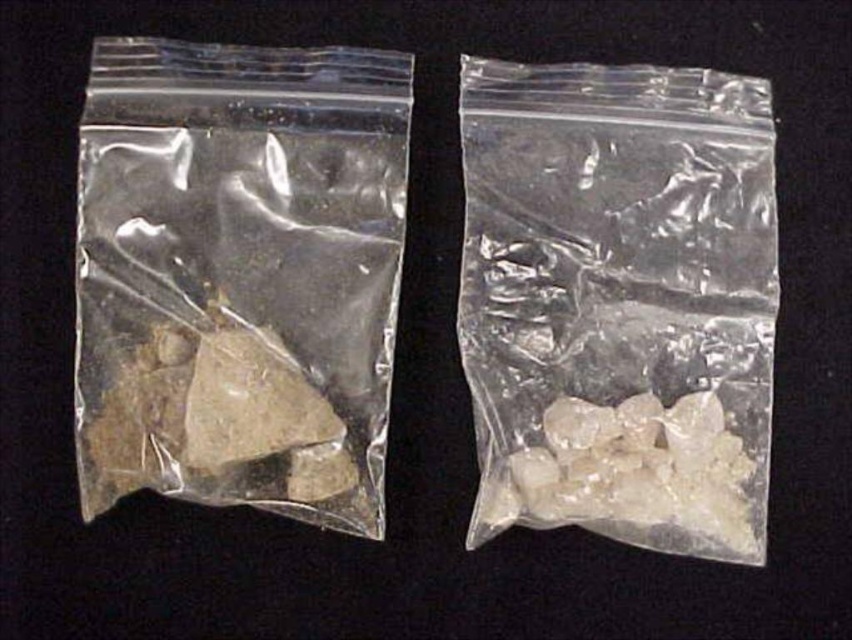
Who is more distant from viewer, [735,403] or [599,518]?

Point [599,518]

Identify the location of transparent plastic bag at center. This screenshot has width=852, height=640. (619, 301).

At what (x,y) coordinates should I click in order to perform the action: click on transparent plastic bag at center. Please return your answer as a coordinate pair (x, y). This screenshot has width=852, height=640. Looking at the image, I should click on (619, 301).

You are a GUI agent. You are given a task and a screenshot of the screen. Output one action in this format:
    pyautogui.click(x=<x>, y=<y>)
    Task: Click on the translucent plastic bag at left
    This screenshot has width=852, height=640.
    Given the screenshot: What is the action you would take?
    pos(239,275)

Which is more to the right, translucent plastic bag at left or transparent plastic bag at center?

Positioned to the right is transparent plastic bag at center.

Identify the location of translucent plastic bag at left. Image resolution: width=852 pixels, height=640 pixels. (239, 275).

Can you confirm if translucent plastic bag at left is thinner than translucent crystal chunks at right?

Incorrect, translucent plastic bag at left's width is not less than translucent crystal chunks at right's.

Which is in front, point (340, 374) or point (538, 490)?

Point (538, 490) is more forward.

The image size is (852, 640). In order to click on translucent plastic bag at left in this screenshot , I will do `click(239, 275)`.